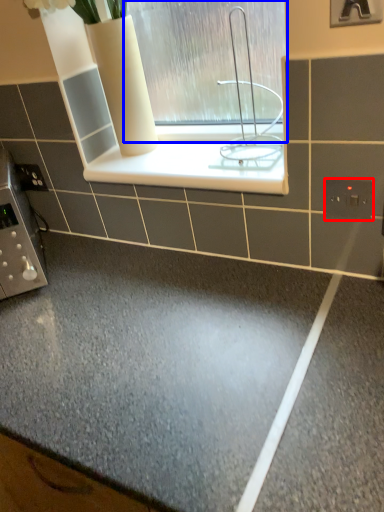
Question: Which object is further to the camera taking this photo, electric outlet (highlighted by a red box) or window (highlighted by a blue box)?

Choices:
 (A) electric outlet
 (B) window

Answer: (A)